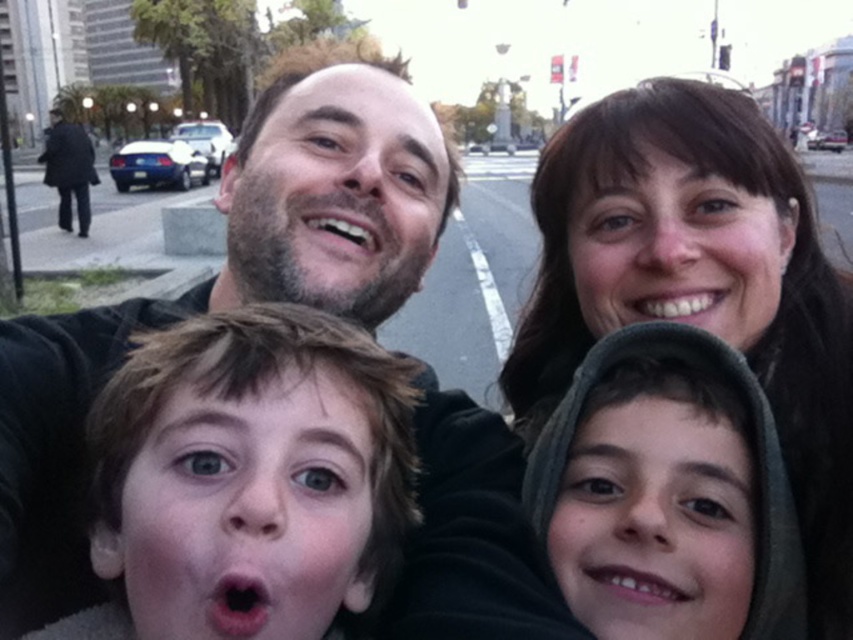
You are a photographer trying to capture the perfect selfie. You notice the dark brown hair at upper center and the smooth gray hoodie at lower right. Which object should you adjust your camera angle to focus on first if you want to ensure both are in frame without moving the subjects?

The dark brown hair at upper center is taller than the smooth gray hoodie at lower right, so you should focus on the dark brown hair at upper center first to ensure it fits within the frame.

Where is the dark brown hair at center located in the image?

The dark brown hair at center is located at point (230, 284).

Based on the photo, you are a photographer trying to capture a group photo of the dark brown hair at center and the smooth skin face at upper right. Which object would require a closer zoom to fill the frame?

The dark brown hair at center is larger in size than the smooth skin face at upper right, so you would need to zoom closer to the smooth skin face at upper right to fill the frame appropriately.